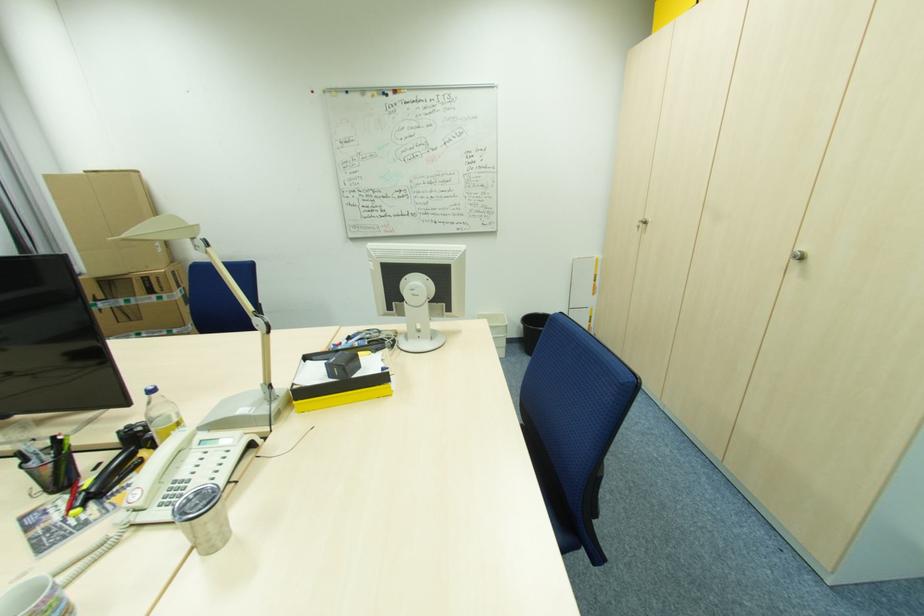
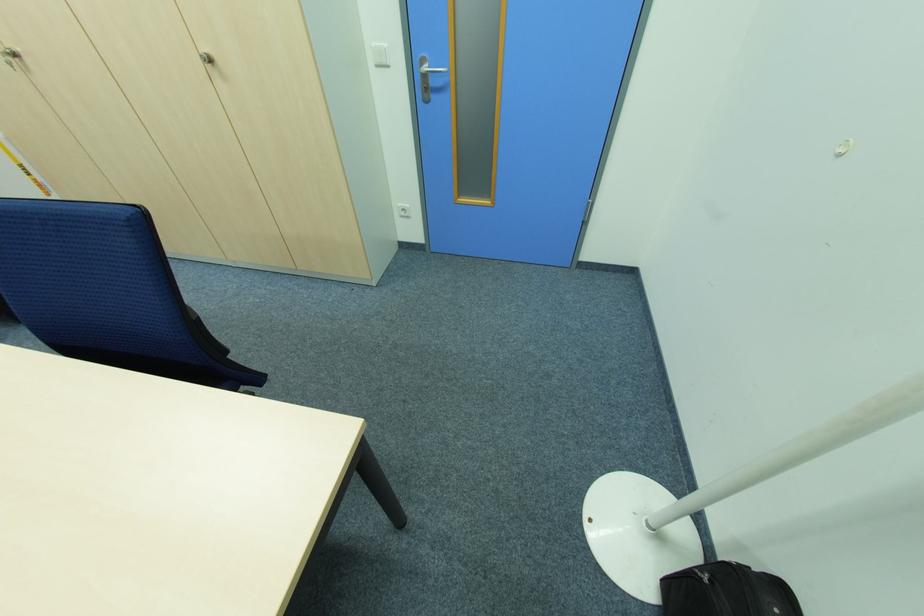
In the second image, find the point that corresponds to (x=649, y=223) in the first image.

(18, 55)